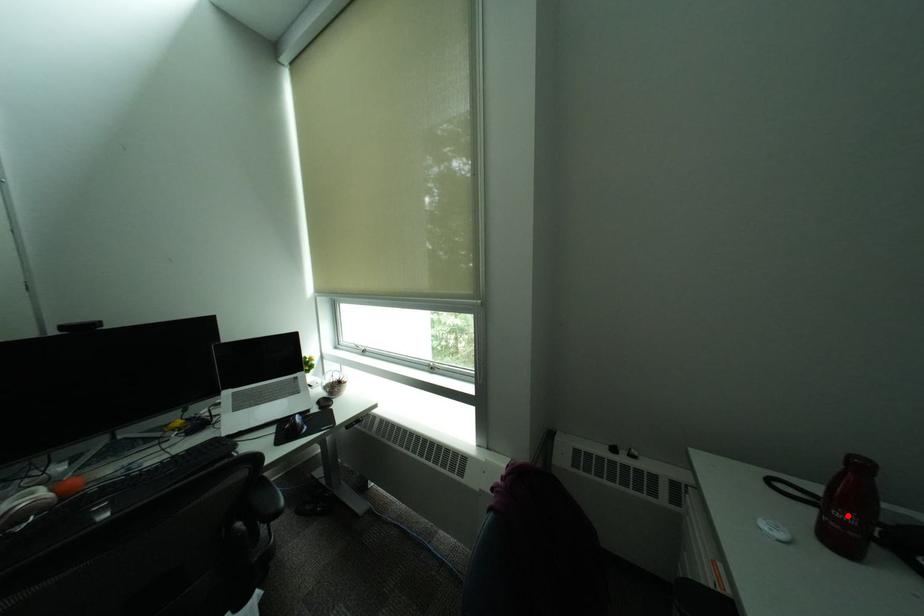
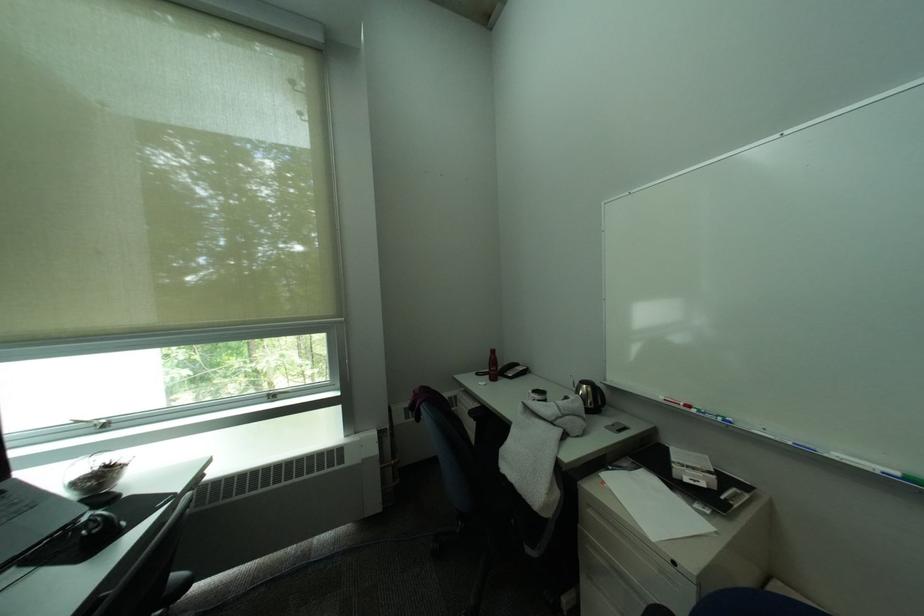
The point at the highlighted location is marked in the first image. Where is the corresponding point in the second image?

(503, 370)